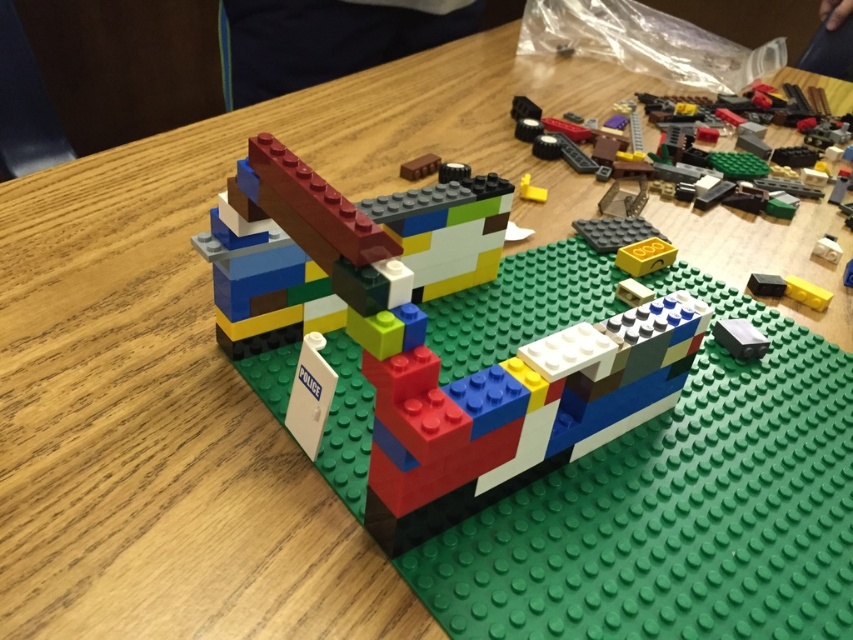
You are a photographer holding a camera and want to take a closeup shot of the multicolored plastic building blocks at center. The camera requires a minimum distance of 45 centimeters to focus properly. Can you take the photo without moving the camera?

The multicolored plastic building blocks at center and camera are 46.54 centimeters apart. Since 46.54 cm is greater than the minimum required 45 cm, you can take the photo without moving the camera.